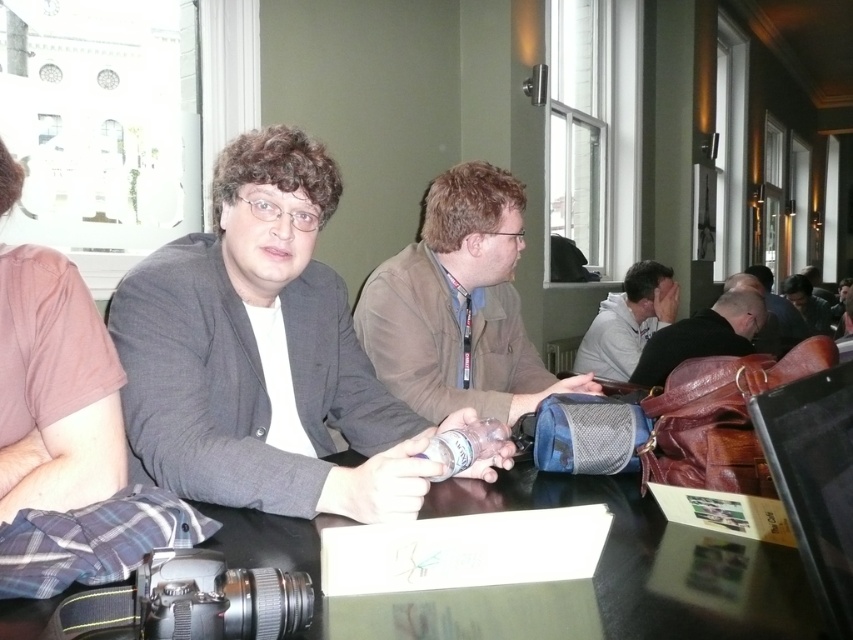
You are standing at the point labeled as point (65, 460) in the image. What object are you directly on?

You are directly on the brown cotton shirt at left.

You are a photographer trying to capture a clear shot of both the brown cotton shirt at left and the dark brown leather jacket at right. Since you want both subjects in focus, which one should you adjust your camera to prioritize focusing on first?

You should prioritize focusing on the brown cotton shirt at left first because it is closer to the viewer than the dark brown leather jacket at right. This way, the camera can establish focus on the nearer subject before adjusting for the farther one.